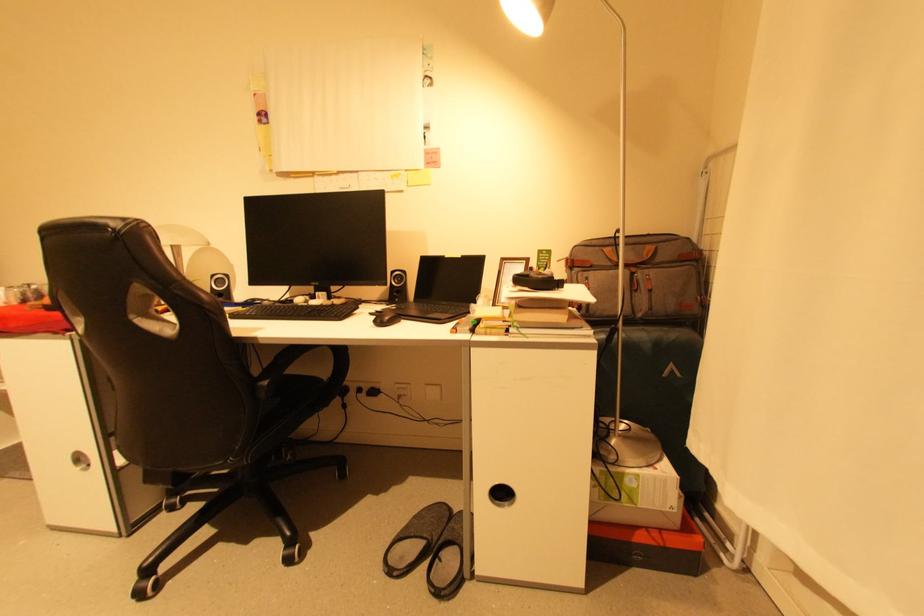
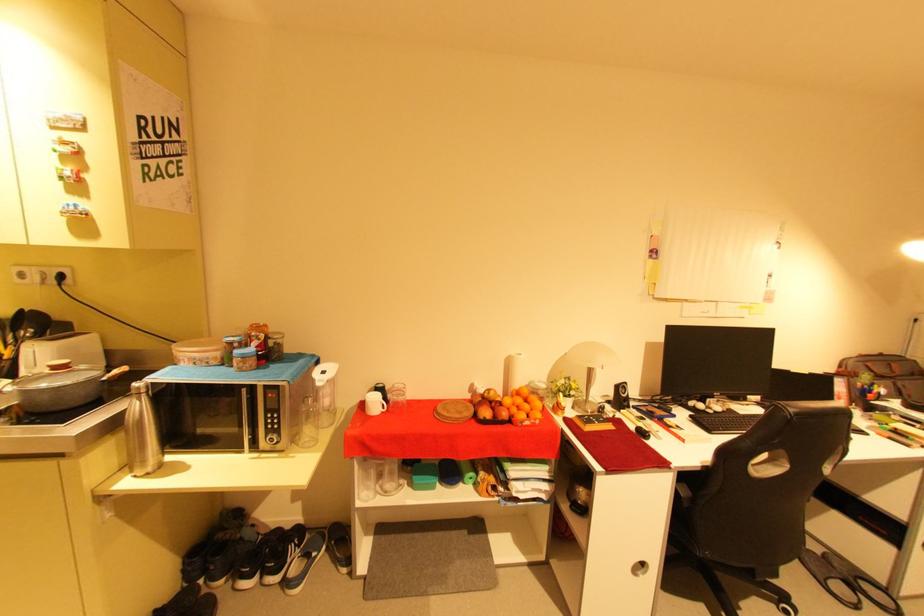
Find the pixel in the second image that matches point (436, 538) in the first image.

(847, 578)